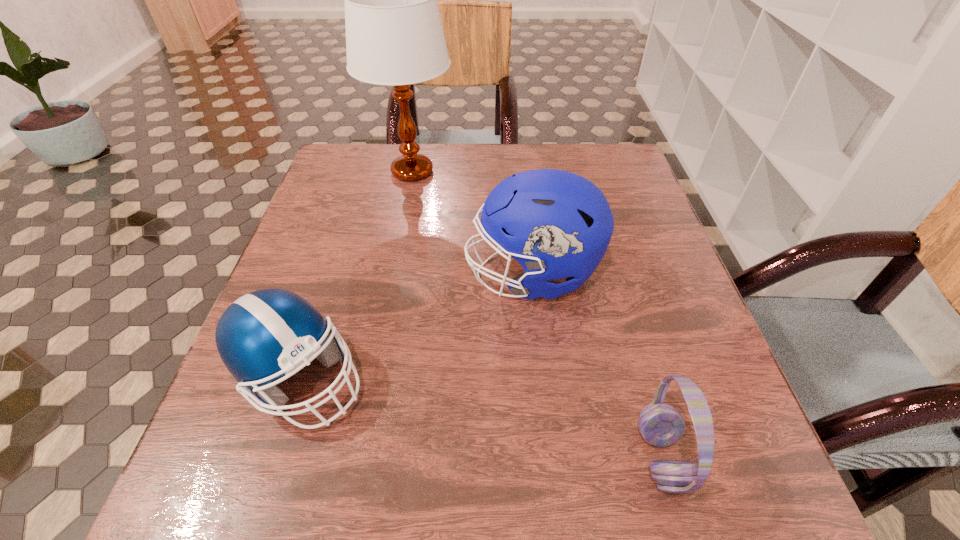
Locate an element on the screen. This screenshot has width=960, height=540. vacant region between the right football helmet and the headset is located at coordinates (596, 366).

The image size is (960, 540). What are the coordinates of `vacant area that lies between the table lamp and the left football helmet` in the screenshot? It's located at (356, 275).

This screenshot has width=960, height=540. Identify the location of free spot between the table lamp and the third shortest object. click(x=472, y=223).

What are the coordinates of `vacant point located between the headset and the nearer football helmet` in the screenshot? It's located at (481, 418).

Locate an element on the screen. This screenshot has width=960, height=540. vacant space that is in between the farther football helmet and the table lamp is located at coordinates (472, 223).

What are the coordinates of `vacant point located between the taller football helmet and the headset` in the screenshot? It's located at (596, 366).

The height and width of the screenshot is (540, 960). Find the location of `vacant space in between the headset and the tallest object`. vacant space in between the headset and the tallest object is located at coordinates (537, 314).

The image size is (960, 540). I want to click on vacant space in between the taller football helmet and the shorter football helmet, so click(417, 327).

Point out which object is positioned as the nearest to the headset. Please provide its 2D coordinates. Your answer should be formatted as a tuple, i.e. [(x, y)], where the tuple contains the x and y coordinates of a point satisfying the conditions above.

[(557, 224)]

At what (x,y) coordinates should I click in order to perform the action: click on object that can be found as the third closest to the headset. Please return your answer as a coordinate pair (x, y). This screenshot has width=960, height=540. Looking at the image, I should click on (394, 36).